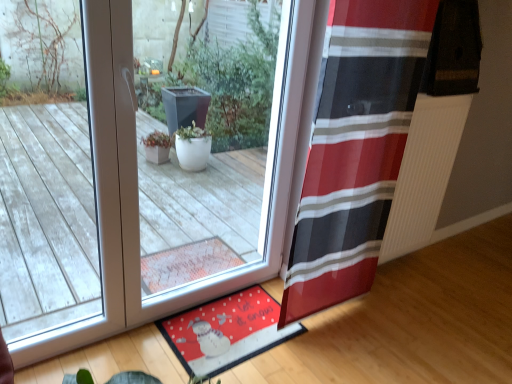
Where is `vacant point above red fabric mat at lower center (from a real-world perspective)`? The image size is (512, 384). vacant point above red fabric mat at lower center (from a real-world perspective) is located at coordinates (234, 331).